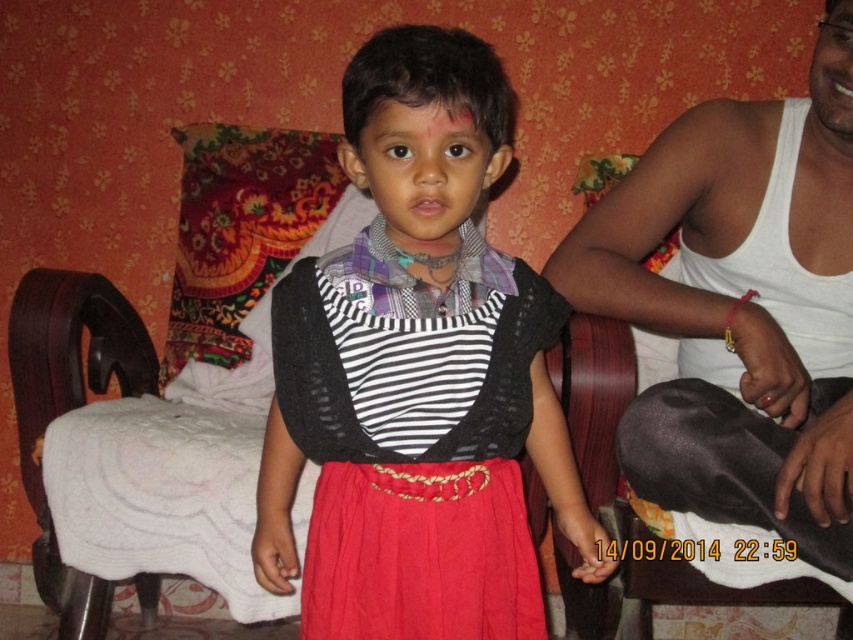
Question: Which point is farther to the camera?

Choices:
 (A) (453, 362)
 (B) (740, 250)
 (C) (96, 321)

Answer: (C)

Question: Is white tank top at right wider than white fabric armchair at left?

Choices:
 (A) yes
 (B) no

Answer: (B)

Question: Is white tank top at right positioned before white fabric armchair at left?

Choices:
 (A) no
 (B) yes

Answer: (B)

Question: Which point appears closest to the camera in this image?

Choices:
 (A) (463, 456)
 (B) (67, 598)

Answer: (A)

Question: Which of the following is the closest to the observer?

Choices:
 (A) white fabric armchair at left
 (B) matte black sweater at center
 (C) white tank top at right

Answer: (B)

Question: Can you confirm if matte black sweater at center is positioned below white tank top at right?

Choices:
 (A) no
 (B) yes

Answer: (B)